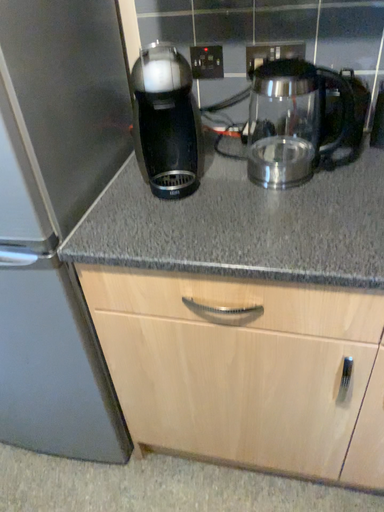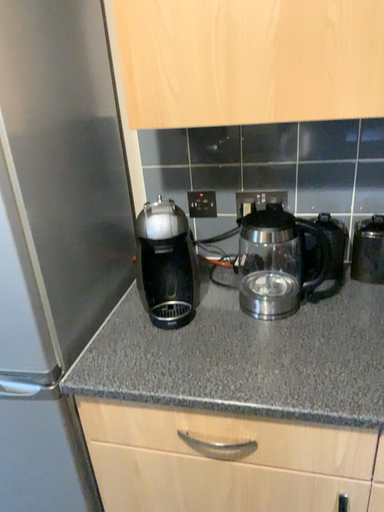
Question: How did the camera likely rotate when shooting the video?

Choices:
 (A) rotated upward
 (B) rotated downward

Answer: (A)